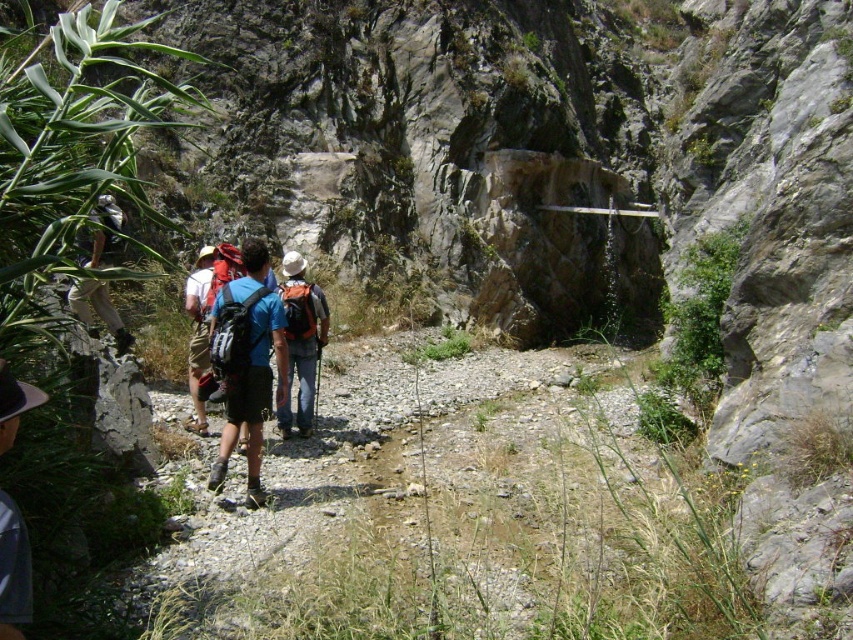
Question: Can you confirm if gravelly dirt path at center is positioned below blue fabric backpack at center?

Choices:
 (A) yes
 (B) no

Answer: (A)

Question: Which of the following is the farthest from the observer?

Choices:
 (A) (6, 372)
 (B) (192, 365)
 (C) (318, 605)
 (D) (303, 262)

Answer: (D)

Question: Is gravelly dirt path at center thinner than matte khaki shorts at left?

Choices:
 (A) no
 (B) yes

Answer: (A)

Question: Which point appears farthest from the camera in this image?

Choices:
 (A) (238, 291)
 (B) (300, 358)
 (C) (112, 234)
 (D) (9, 605)

Answer: (C)

Question: Does white felt hat at lower left have a greater width compared to matte khaki shorts at left?

Choices:
 (A) no
 (B) yes

Answer: (A)

Question: Estimate the real-world distances between objects in this image. Which object is closer to the blue fabric backpack at center?

Choices:
 (A) matte blue shirt at center
 (B) gravelly dirt path at center
 (C) matte khaki shorts at left

Answer: (A)